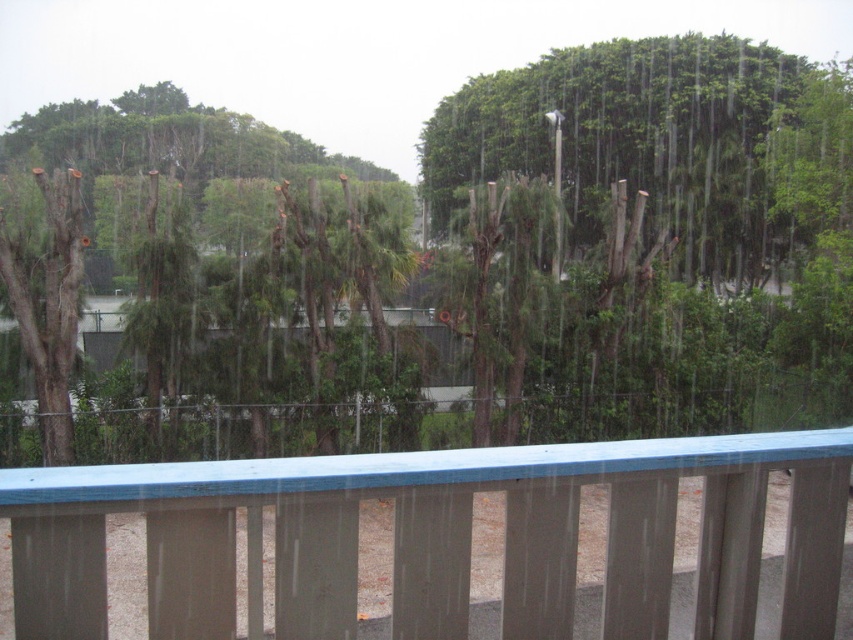
Consider the image. Who is higher up, green matte tree at center or blue painted wood at center?

green matte tree at center is above.

Locate an element on the screen. The image size is (853, 640). green matte tree at center is located at coordinates (641, 241).

Which is behind, point (393, 387) or point (215, 570)?

The point (393, 387) is behind.

I want to click on green matte tree at center, so click(641, 241).